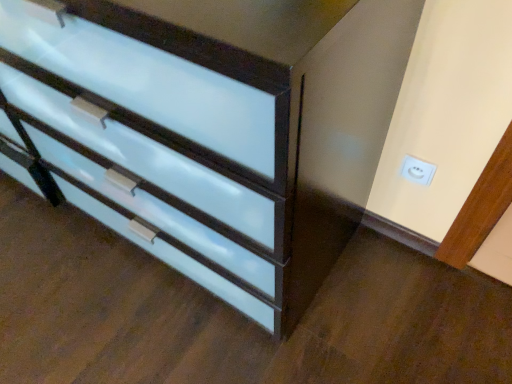
Question: Do you think white plastic electric outlet at upper right is within matte white chest of drawers at lower left, or outside of it?

Choices:
 (A) outside
 (B) inside

Answer: (A)

Question: Visually, is white plastic electric outlet at upper right positioned to the left or to the right of matte white chest of drawers at lower left?

Choices:
 (A) left
 (B) right

Answer: (B)

Question: Considering the positions of white plastic electric outlet at upper right and matte white chest of drawers at lower left in the image, is white plastic electric outlet at upper right wider or thinner than matte white chest of drawers at lower left?

Choices:
 (A) wide
 (B) thin

Answer: (B)

Question: From a real-world perspective, is matte white chest of drawers at lower left positioned above or below white plastic electric outlet at upper right?

Choices:
 (A) below
 (B) above

Answer: (B)

Question: Is matte white chest of drawers at lower left taller or shorter than white plastic electric outlet at upper right?

Choices:
 (A) tall
 (B) short

Answer: (A)

Question: Relative to white plastic electric outlet at upper right, is matte white chest of drawers at lower left in front or behind?

Choices:
 (A) behind
 (B) front

Answer: (B)

Question: Does point (266, 152) appear closer or farther from the camera than point (415, 167)?

Choices:
 (A) farther
 (B) closer

Answer: (B)